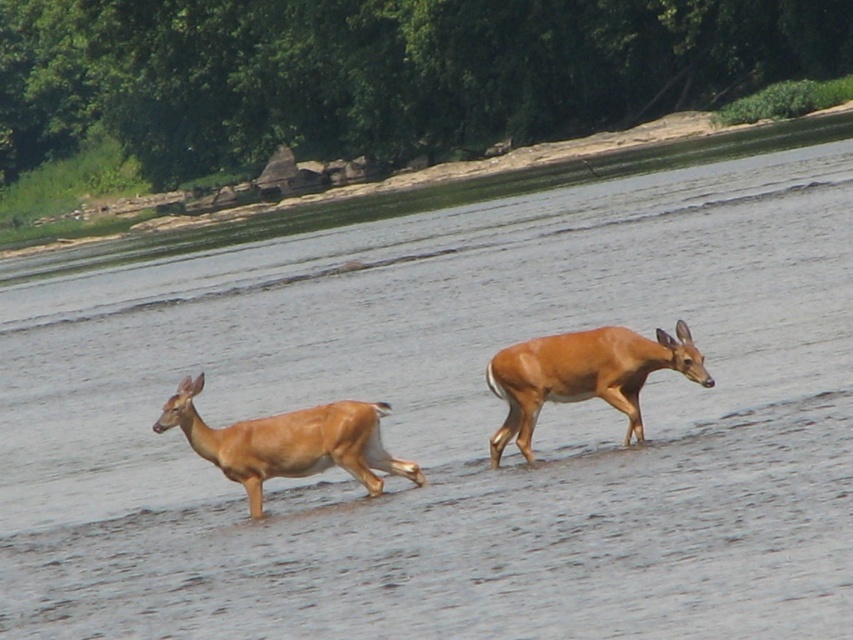
Can you confirm if shiny brown deer at center is positioned to the right of light brown fur deer at center?

Correct, you'll find shiny brown deer at center to the right of light brown fur deer at center.

Can you confirm if shiny brown deer at center is smaller than light brown fur deer at center?

Incorrect, shiny brown deer at center is not smaller in size than light brown fur deer at center.

Does point (668, 352) lie behind point (254, 486)?

No.

Find the location of `shiny brown deer at center`. shiny brown deer at center is located at coordinates (583, 376).